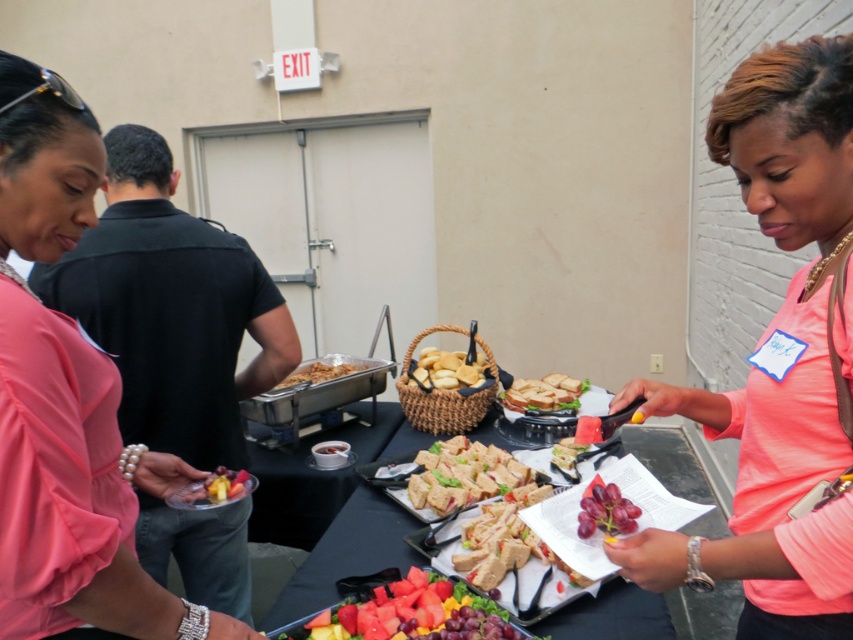
Measure the distance between golden brown bread at center and white bread sandwich at center.

8.37 inches

This screenshot has width=853, height=640. Identify the location of golden brown bread at center. (445, 369).

Describe the element at coordinates (445, 369) in the screenshot. The height and width of the screenshot is (640, 853). I see `golden brown bread at center` at that location.

Image resolution: width=853 pixels, height=640 pixels. Find the location of `golden brown bread at center`. golden brown bread at center is located at coordinates (445, 369).

Is pink fabric shirt at left bigger than white bread sandwich at center?

Yes, pink fabric shirt at left is bigger than white bread sandwich at center.

Is pink fabric shirt at left smaller than white bread sandwich at center?

Actually, pink fabric shirt at left might be larger than white bread sandwich at center.

Identify the location of pink fabric shirt at left. (67, 403).

The width and height of the screenshot is (853, 640). Identify the location of pink fabric shirt at left. (67, 403).

Which is in front, point (721, 573) or point (289, 385)?

Point (721, 573) is more forward.

Which is more to the left, pink matte shirt at center or matte silver platter at center?

Positioned to the left is matte silver platter at center.

This screenshot has width=853, height=640. What do you see at coordinates (778, 356) in the screenshot?
I see `pink matte shirt at center` at bounding box center [778, 356].

Locate an element on the screen. The image size is (853, 640). pink matte shirt at center is located at coordinates (778, 356).